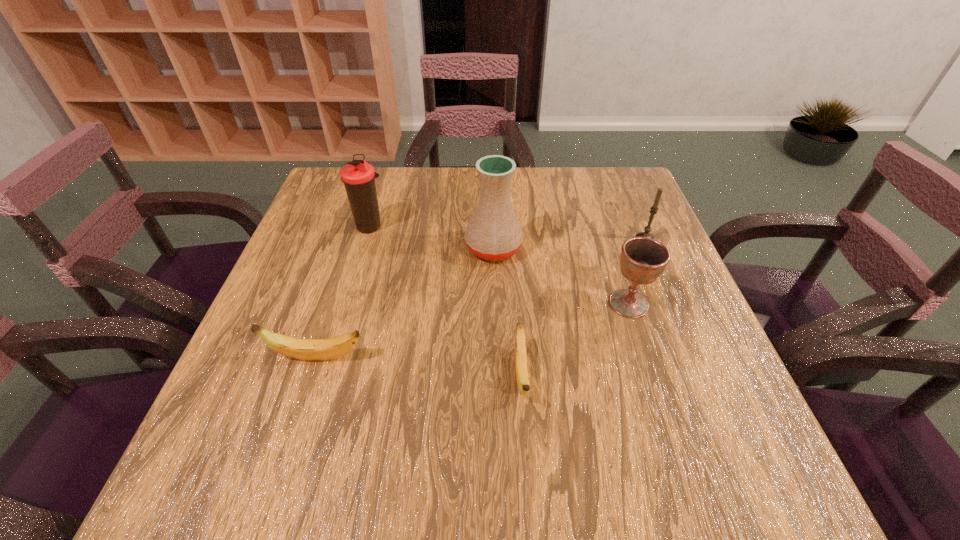
Identify the location of vacant place for an extra banana on the right. (739, 394).